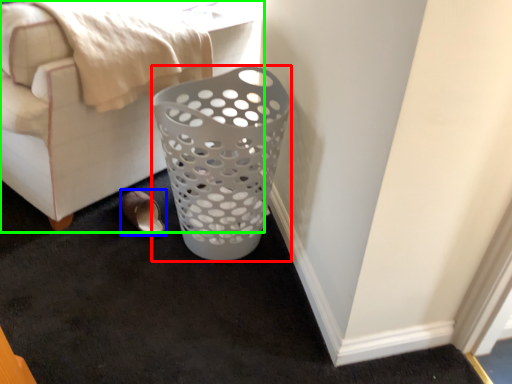
Question: Which object is the closest to the basket (highlighted by a red box)? Choose among these: footwear (highlighted by a blue box) or furniture (highlighted by a green box).

Choices:
 (A) footwear
 (B) furniture

Answer: (B)